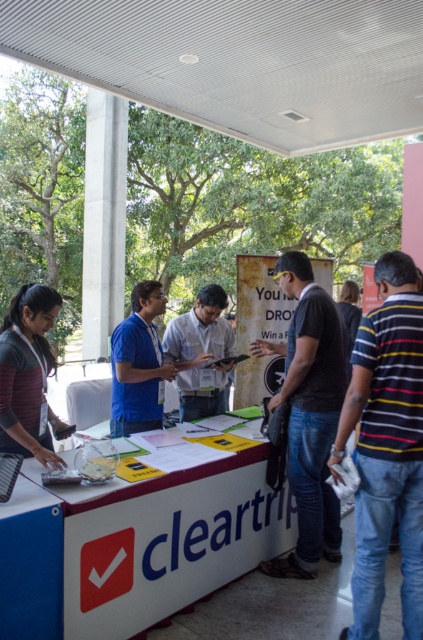
You are standing at the center of the image. There is a point marked at coordinates (387, 445). Which object from the list is located at that point?

The point at coordinates (387, 445) corresponds to the striped cotton shirt at right.